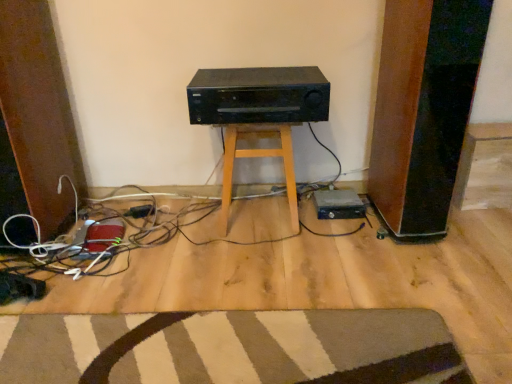
You are a GUI agent. You are given a task and a screenshot of the screen. Output one action in this format:
    pyautogui.click(x=<x>, y=<y>)
    Task: Click on the free region under wooden stool at center (from a real-world perspective)
    
    Given the screenshot: What is the action you would take?
    pyautogui.click(x=257, y=217)